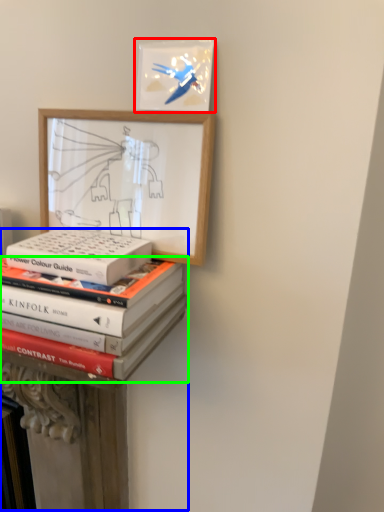
Question: Which object is positioned closest to picture frame (highlighted by a red box)? Select from bookshelf (highlighted by a blue box) and book (highlighted by a green box).

Choices:
 (A) bookshelf
 (B) book

Answer: (B)